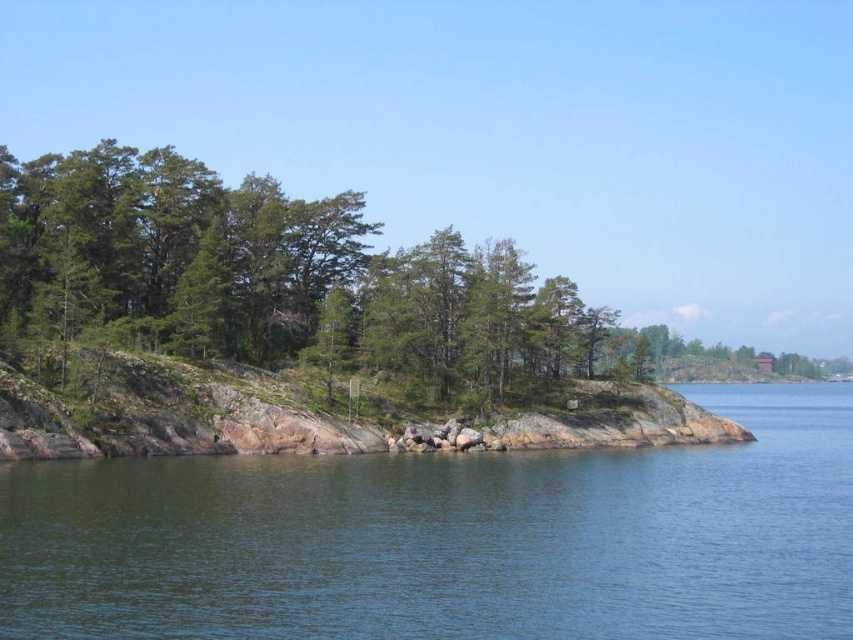
Is point (780, 637) farther from camera compared to point (259, 266)?

No.

Between clear blue water at lower left and green leafy trees at center, which one appears on the right side from the viewer's perspective?

Positioned to the right is clear blue water at lower left.

Does point (19, 500) lie in front of point (312, 304)?

Yes, it is.

At what (x,y) coordinates should I click in order to perform the action: click on clear blue water at lower left. Please return your answer as a coordinate pair (x, y). Looking at the image, I should click on (450, 540).